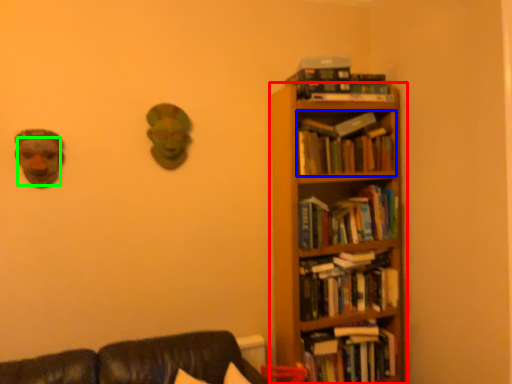
Question: Which is farther away from bookcase (highlighted by a red box)? book (highlighted by a blue box) or human face (highlighted by a green box)?

Choices:
 (A) book
 (B) human face

Answer: (B)